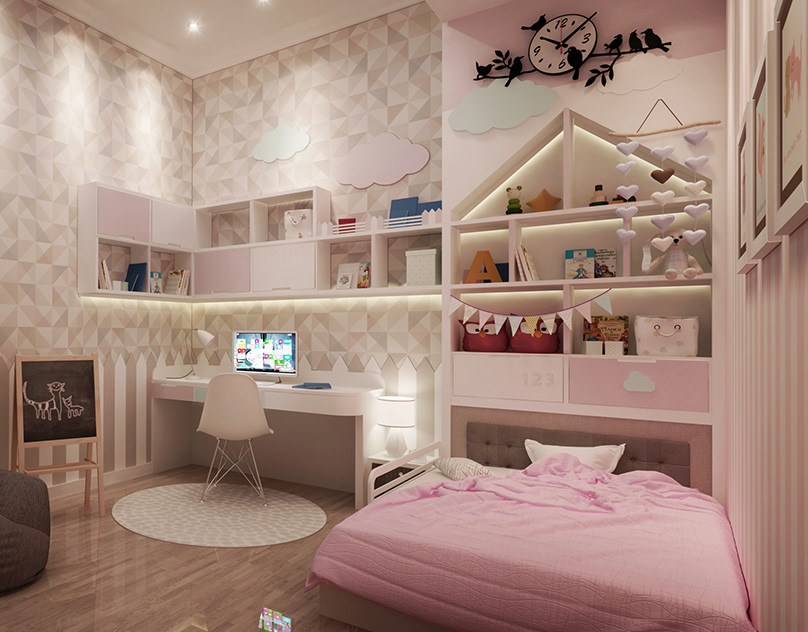
Find the location of `white pillow`. white pillow is located at coordinates (588, 458).